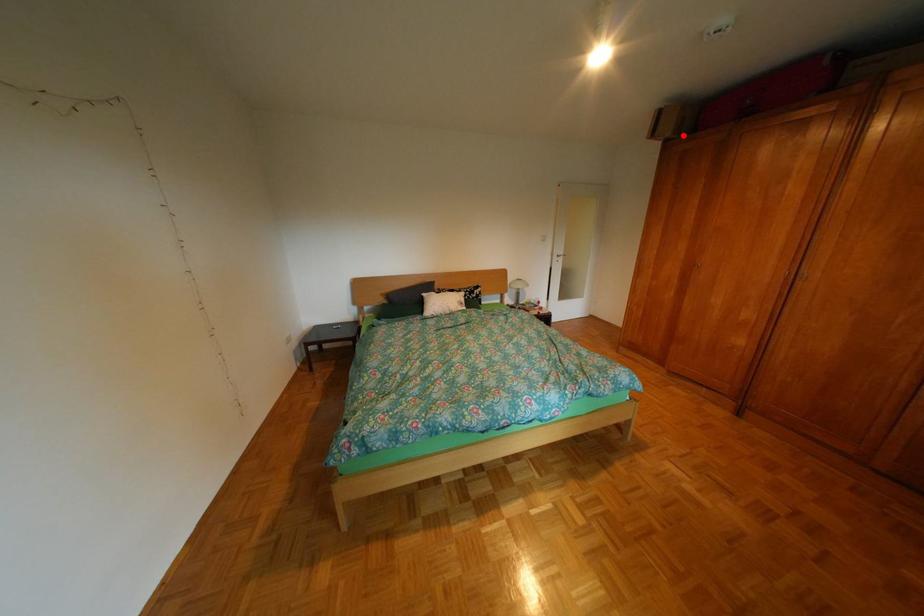
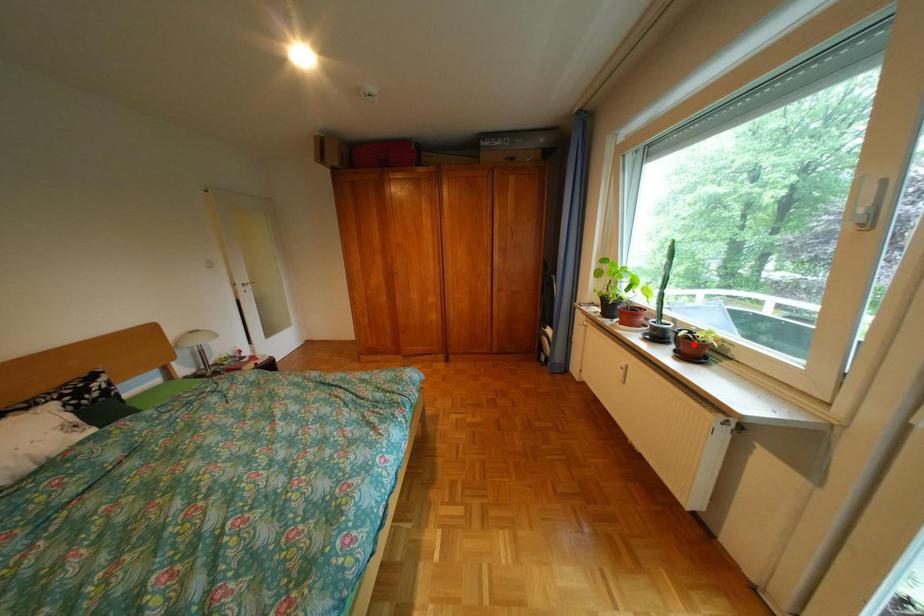
I am providing you with two images of the same scene from different viewpoints. A red point is marked on the first image and another point is marked on the second image. Is the marked point in image1 the same physical position as the marked point in image2?

No